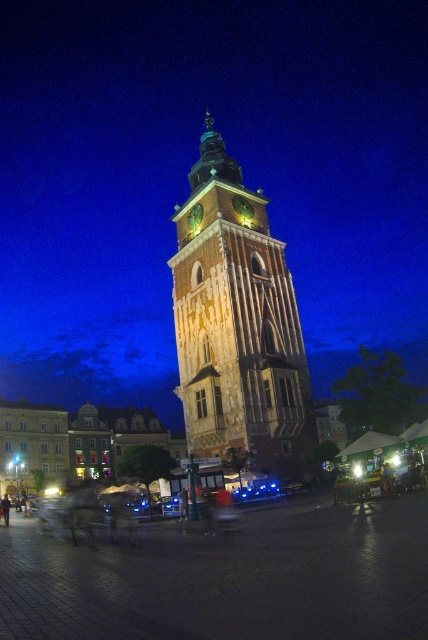
Question: Is stone clock tower at center smaller than gold textured clock at center?

Choices:
 (A) yes
 (B) no

Answer: (B)

Question: Does stone clock tower at center appear under gold textured clock at center?

Choices:
 (A) yes
 (B) no

Answer: (B)

Question: Which object is closer to the camera taking this photo?

Choices:
 (A) stone clock tower at center
 (B) gold textured clock at center
 (C) green stone clock at center

Answer: (A)

Question: Which point is farther to the camera?

Choices:
 (A) pos(196,172)
 (B) pos(253,212)

Answer: (A)

Question: Can you confirm if stone clock tower at center is positioned to the right of green stone clock at center?

Choices:
 (A) no
 (B) yes

Answer: (B)

Question: Estimate the real-world distances between objects in this image. Which object is farther from the green stone clock at center?

Choices:
 (A) gold textured clock at center
 (B) stone clock tower at center

Answer: (B)